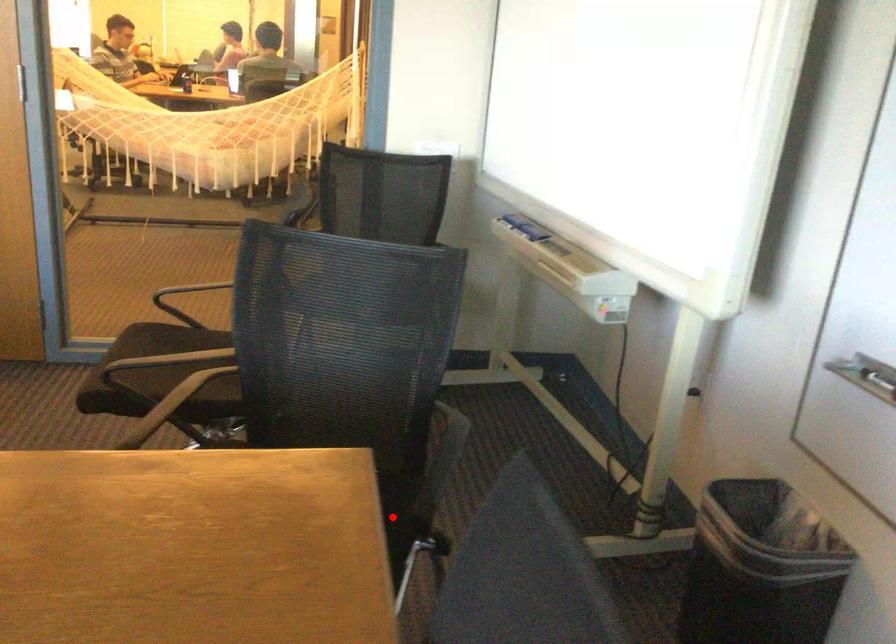
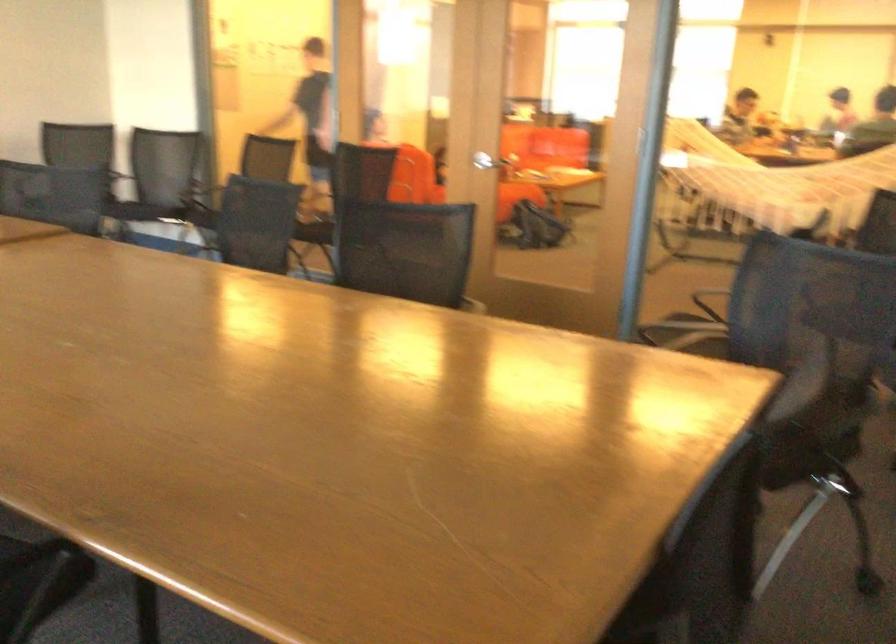
Question: I am providing you with two images of the same scene from different viewpoints. A red point is marked on the first image. At the location where the point appears in image 1, is it still visible in image 2?

Choices:
 (A) Yes
 (B) No

Answer: (A)